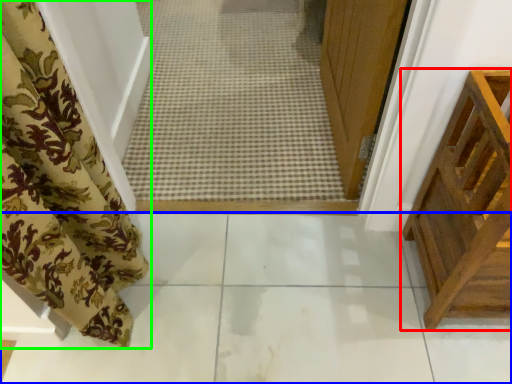
Question: Estimate the real-world distances between objects in this image. Which object is closer to furniture (highlighted by a red box), path (highlighted by a blue box) or curtain (highlighted by a green box)?

Choices:
 (A) path
 (B) curtain

Answer: (A)